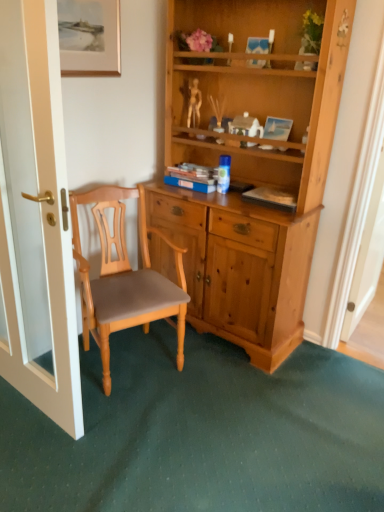
At what (x,y) coordinates should I click in order to perform the action: click on light brown wood chair at center. Please return your answer as a coordinate pair (x, y). The width and height of the screenshot is (384, 512). Looking at the image, I should click on click(x=124, y=278).

Identify the location of gold-framed painting at upper left. This screenshot has width=384, height=512. (89, 37).

Identify the location of white glossy door at left. This screenshot has width=384, height=512. (36, 216).

Is blue glossy coffee cup at center further to the viewer compared to blue matte book at center?

No, the depth of blue glossy coffee cup at center is less than that of blue matte book at center.

Can you confirm if blue glossy coffee cup at center is smaller than blue matte book at center?

Indeed, blue glossy coffee cup at center has a smaller size compared to blue matte book at center.

Is blue glossy coffee cup at center oriented towards blue matte book at center?

No, blue glossy coffee cup at center is not turned towards blue matte book at center.

Which point is more forward, (220,163) or (199,189)?

Point (199,189)

Is light brown wood chair at center in front of blue matte book at center?

Yes, light brown wood chair at center is closer to the camera.

Which of these two, light brown wood chair at center or blue matte book at center, is bigger?

light brown wood chair at center is bigger.

Can you tell me how much light brown wood chair at center and blue matte book at center differ in facing direction?

The angle between the facing direction of light brown wood chair at center and the facing direction of blue matte book at center is 68.4 degrees.

Does light brown wood chair at center appear on the left side of blue matte book at center?

Yes.

Is light brown wood chair at center next to blue glossy coffee cup at center?

No, light brown wood chair at center is not making contact with blue glossy coffee cup at center.

Looking at this image, from a real-world perspective, who is located lower, light brown wood chair at center or blue glossy coffee cup at center?

In real-world perspective, light brown wood chair at center is lower.

Which is behind, point (99, 284) or point (222, 168)?

The point (222, 168) is farther.

Which of these two, light brown wood chair at center or blue glossy coffee cup at center, is smaller?

blue glossy coffee cup at center.

Which is nearer, [217,188] or [72,17]?

The point [72,17] is closer to the camera.

How different are the orientations of blue glossy coffee cup at center and gold-framed painting at upper left in degrees?

90.5 degrees separate the facing orientations of blue glossy coffee cup at center and gold-framed painting at upper left.

From their relative heights in the image, would you say blue glossy coffee cup at center is taller or shorter than gold-framed painting at upper left?

Considering their sizes, blue glossy coffee cup at center has less height than gold-framed painting at upper left.

Is blue glossy coffee cup at center completely or partially outside of gold-framed painting at upper left?

Indeed, blue glossy coffee cup at center is completely outside gold-framed painting at upper left.

Measure the distance from white glossy door at left to light brown wood chair at center.

white glossy door at left is 15.08 inches away from light brown wood chair at center.

Are white glossy door at left and light brown wood chair at center far apart?

No, there isn't a large distance between white glossy door at left and light brown wood chair at center.

Which is in front, white glossy door at left or light brown wood chair at center?

white glossy door at left.

Find the location of a particular element. This screenshot has height=512, width=384. picture frame on the left of blue matte book at center is located at coordinates (89, 37).

Is gold-framed painting at upper left taller than blue matte book at center?

Correct, gold-framed painting at upper left is much taller as blue matte book at center.

From a real-world perspective, relative to blue matte book at center, is gold-framed painting at upper left vertically above or below?

Clearly, from a real-world perspective, gold-framed painting at upper left is above blue matte book at center.

Looking at this image, considering the relative sizes of gold-framed painting at upper left and blue matte book at center in the image provided, is gold-framed painting at upper left smaller than blue matte book at center?

Correct, gold-framed painting at upper left occupies less space than blue matte book at center.

Is point (168, 183) closer to viewer compared to point (147, 277)?

No, it is not.

Is the position of blue matte book at center more distant than that of light brown wood chair at center?

Yes, blue matte book at center is further from the camera.

Measure the distance between blue matte book at center and light brown wood chair at center.

The distance of blue matte book at center from light brown wood chair at center is 21.48 inches.

Is blue matte book at center located outside light brown wood chair at center?

Yes, blue matte book at center is located beyond the bounds of light brown wood chair at center.

There is a blue matte book at center. Where is `coffee cup above it (from a real-world perspective)`? coffee cup above it (from a real-world perspective) is located at coordinates (224, 174).

Where is `chair in front of the blue matte book at center`? chair in front of the blue matte book at center is located at coordinates (124, 278).

Based on their spatial positions, is blue matte book at center or light brown wood chair at center further from blue glossy coffee cup at center?

light brown wood chair at center is further to blue glossy coffee cup at center.

From the image, which object appears to be farther from light brown wood chair at center, blue glossy coffee cup at center or white glossy door at left?

blue glossy coffee cup at center is positioned further to the anchor light brown wood chair at center.

Which object lies nearer to the anchor point white glossy door at left, blue matte book at center or blue glossy coffee cup at center?

blue matte book at center is positioned closer to the anchor white glossy door at left.

Based on the photo, when comparing their distances from white glossy door at left, does gold-framed painting at upper left or blue glossy coffee cup at center seem further?

blue glossy coffee cup at center lies further to white glossy door at left than the other object.

Estimate the real-world distances between objects in this image. Which object is closer to blue matte book at center, blue glossy coffee cup at center or gold-framed painting at upper left?

blue glossy coffee cup at center is closer to blue matte book at center.

Looking at the image, which one is located further to blue glossy coffee cup at center, gold-framed painting at upper left or white glossy door at left?

white glossy door at left lies further to blue glossy coffee cup at center than the other object.

Considering their positions, is blue matte book at center positioned closer to light brown wood chair at center than blue glossy coffee cup at center?

blue matte book at center is closer to light brown wood chair at center.

Based on their spatial positions, is light brown wood chair at center or blue glossy coffee cup at center closer to gold-framed painting at upper left?

Based on the image, light brown wood chair at center appears to be nearer to gold-framed painting at upper left.

Locate an element on the screen. Image resolution: width=384 pixels, height=512 pixels. chair between white glossy door at left and blue matte book at center in the front-back direction is located at coordinates (124, 278).

Find the location of `chair positioned between white glossy door at left and blue glossy coffee cup at center from near to far`. chair positioned between white glossy door at left and blue glossy coffee cup at center from near to far is located at coordinates (124, 278).

The height and width of the screenshot is (512, 384). I want to click on book between gold-framed painting at upper left and light brown wood chair at center from top to bottom, so click(x=192, y=177).

Find the location of a particular element. coffee cup between light brown wood chair at center and blue matte book at center in the front-back direction is located at coordinates (224, 174).